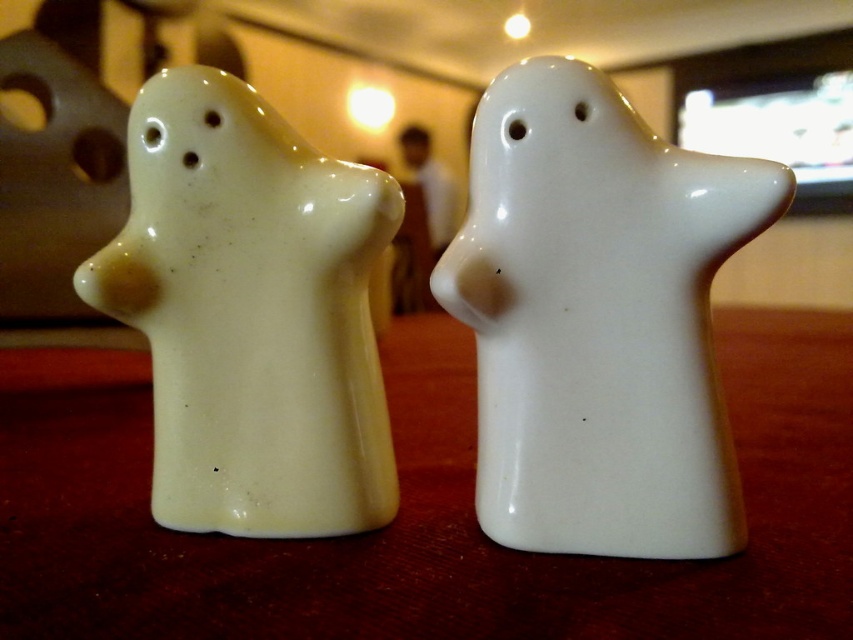
I want to click on white glossy ghost at center, so click(598, 317).

Which is in front, point (610, 314) or point (190, 260)?

Point (610, 314)

The height and width of the screenshot is (640, 853). What do you see at coordinates (598, 317) in the screenshot?
I see `white glossy ghost at center` at bounding box center [598, 317].

In order to click on white glossy ghost at center in this screenshot , I will do pos(598,317).

In the scene shown: Who is higher up, white glossy table at center or matte white ghost at left?

matte white ghost at left is above.

Is white glossy table at center positioned before matte white ghost at left?

Yes, white glossy table at center is closer to the viewer.

I want to click on white glossy table at center, so click(419, 513).

Image resolution: width=853 pixels, height=640 pixels. Describe the element at coordinates (419, 513) in the screenshot. I see `white glossy table at center` at that location.

Is white glossy table at center above white glossy ghost at center?

Incorrect, white glossy table at center is not positioned above white glossy ghost at center.

Does point (260, 620) come closer to viewer compared to point (534, 72)?

Yes.

The width and height of the screenshot is (853, 640). Identify the location of white glossy table at center. (419, 513).